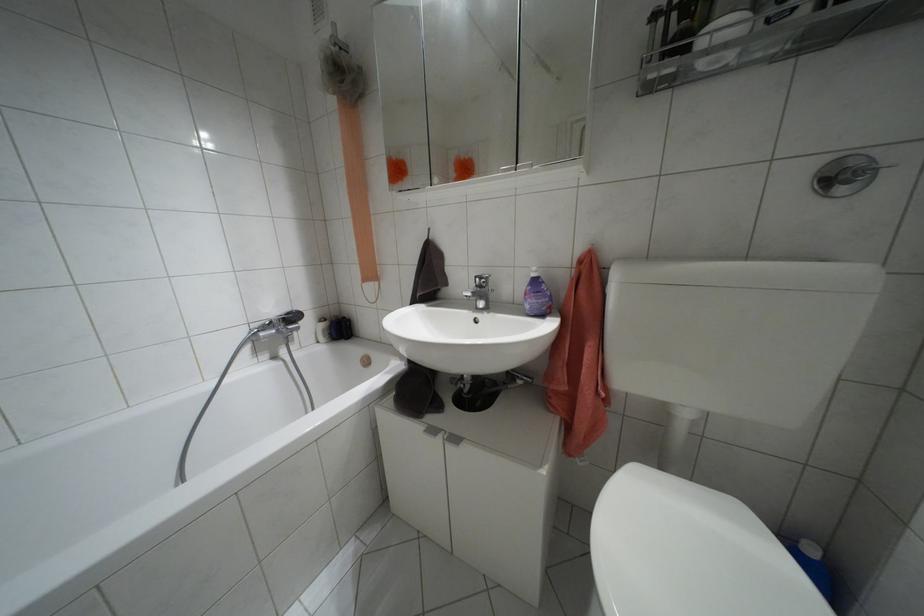
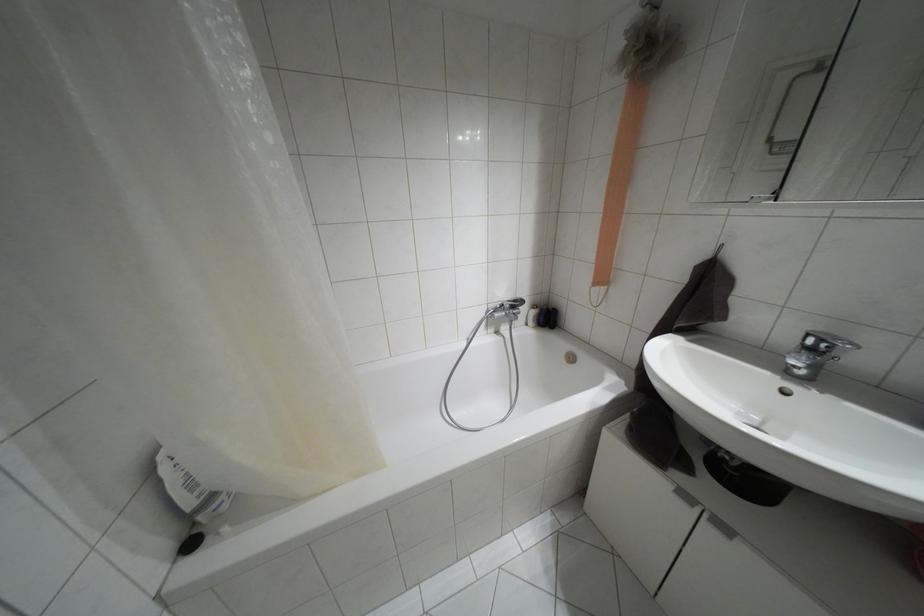
Find the pixel in the second image that matches point 339,329 in the first image.

(546, 317)